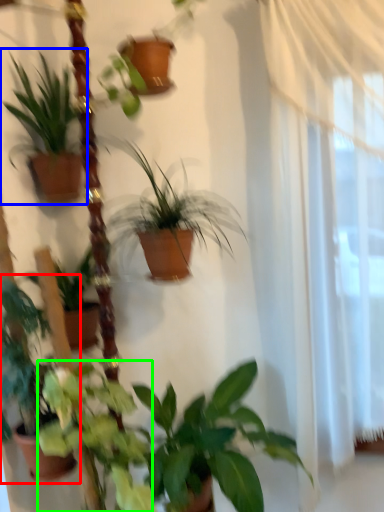
Question: Which is farther away from houseplant (highlighted by a red box)? houseplant (highlighted by a blue box) or plant (highlighted by a green box)?

Choices:
 (A) houseplant
 (B) plant

Answer: (A)